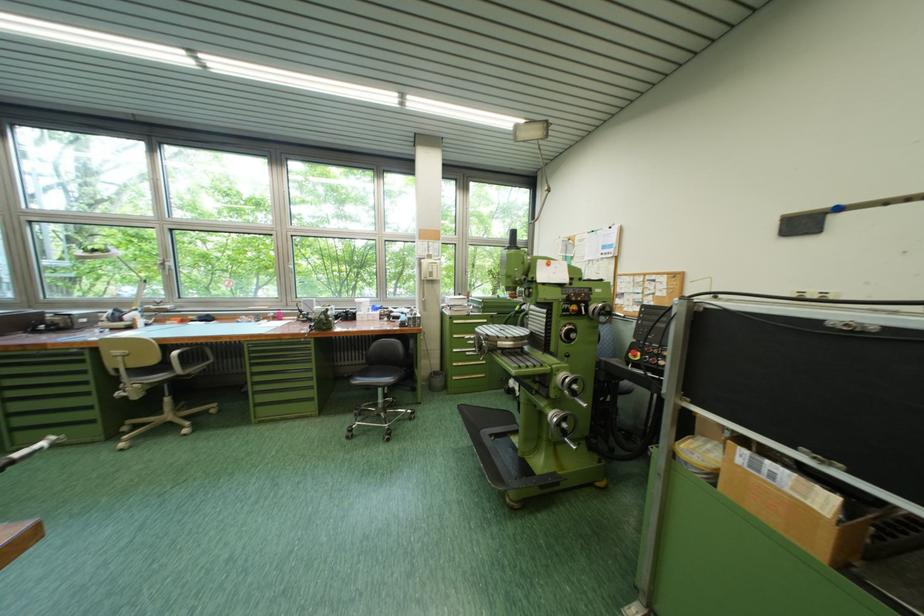
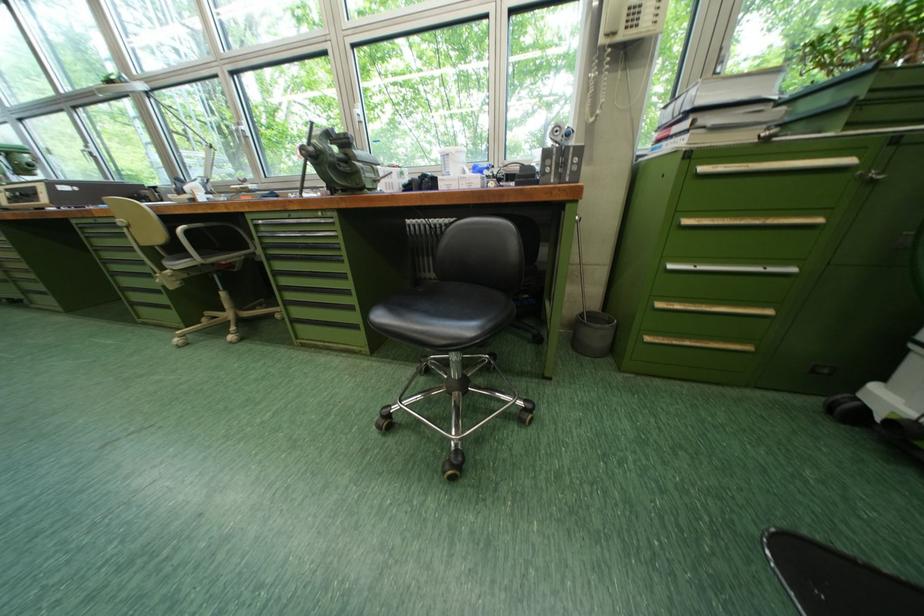
The point at (466, 339) is marked in the first image. Where is the corresponding point in the second image?

(698, 224)